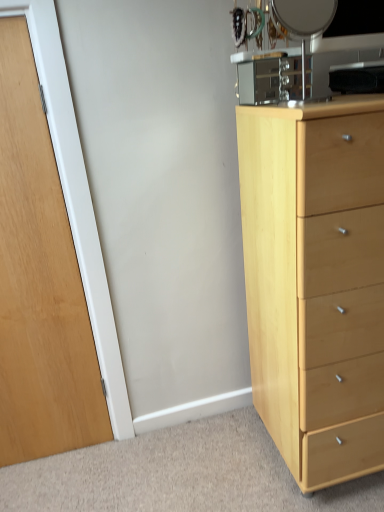
Where is `vacant area that is in front of metallic silver mirror at upper right`? The image size is (384, 512). vacant area that is in front of metallic silver mirror at upper right is located at coordinates (317, 105).